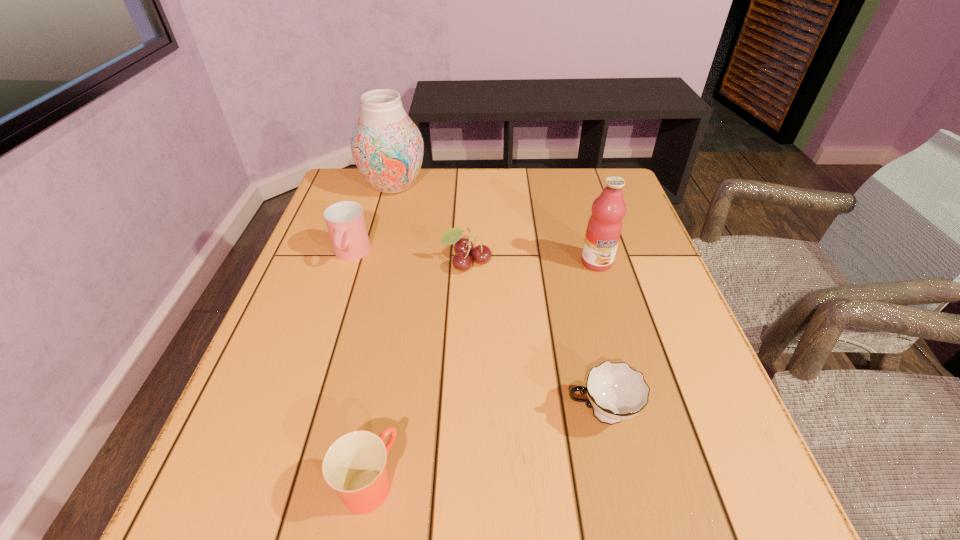
Identify the location of vase. (387, 147).

Locate an element on the screen. the farthest object is located at coordinates (387, 147).

This screenshot has height=540, width=960. In order to click on the second tallest object in this screenshot , I will do `click(604, 228)`.

Find the location of a particular element. Image resolution: width=960 pixels, height=540 pixels. the leftmost cup is located at coordinates click(345, 221).

At what (x,y) coordinates should I click in order to perform the action: click on cherry. Please return your answer as a coordinate pair (x, y). Looking at the image, I should click on (481, 254).

At what (x,y) coordinates should I click in order to perform the action: click on the nearest cup. Please return your answer as a coordinate pair (x, y). This screenshot has width=960, height=540. Looking at the image, I should click on (354, 465).

Find the location of a particular element. the nearest object is located at coordinates (354, 465).

Locate an element on the screen. The height and width of the screenshot is (540, 960). the rightmost cup is located at coordinates (615, 391).

Locate an element on the screen. The width and height of the screenshot is (960, 540). the second farthest cup is located at coordinates (615, 391).

Locate an element on the screen. This screenshot has width=960, height=540. vacant point located on the front of the vase is located at coordinates (368, 282).